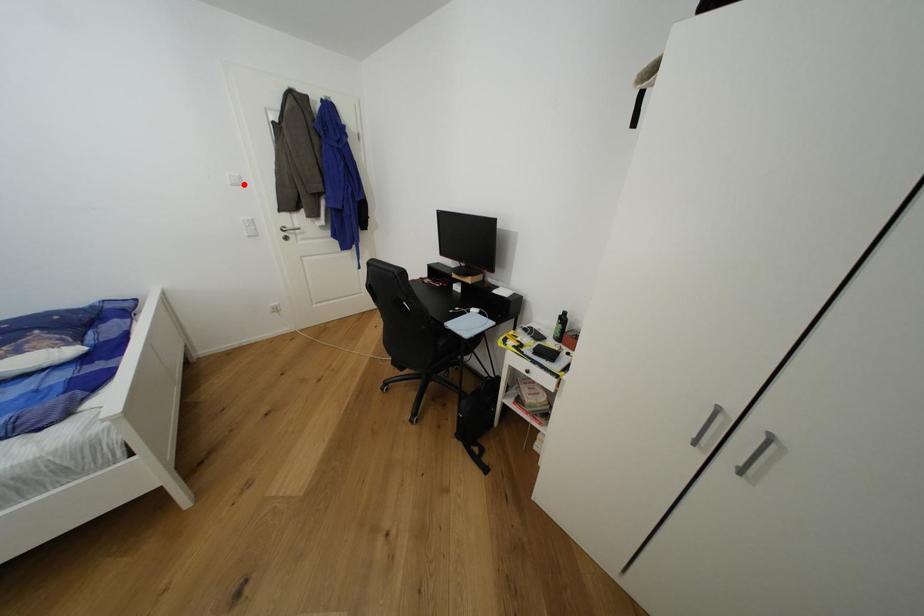
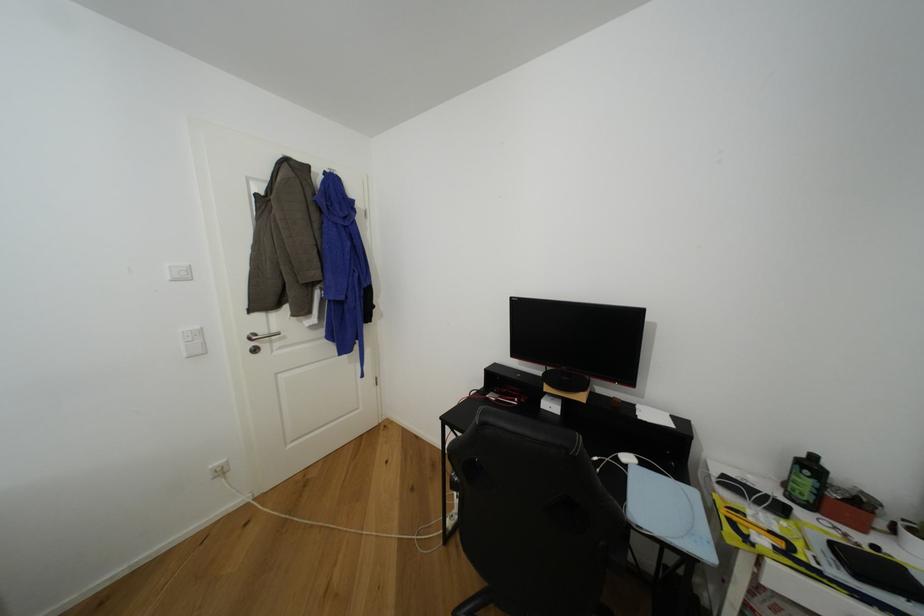
Locate, in the second image, the point that corresponds to the highlighted location in the first image.

(190, 278)